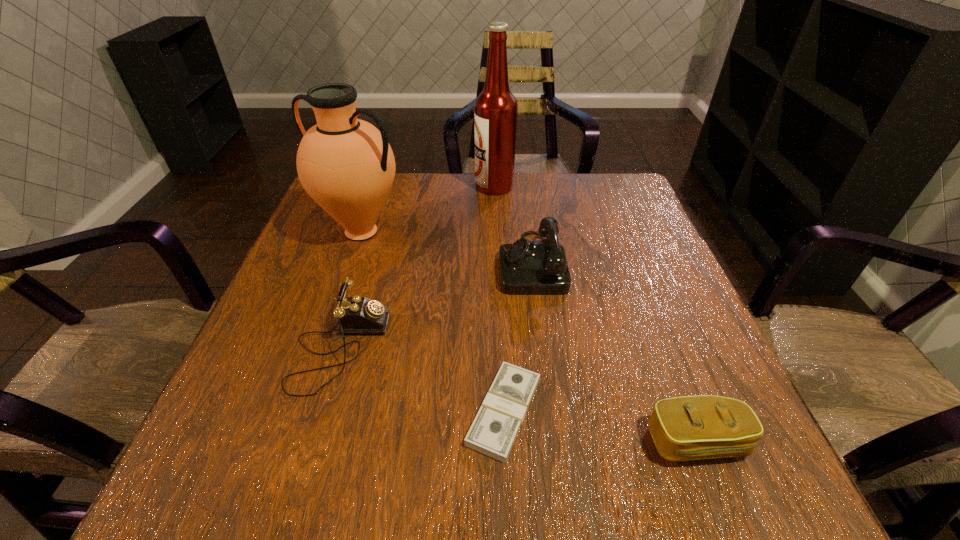
Find the location of a particular element. The height and width of the screenshot is (540, 960). alcohol is located at coordinates (495, 117).

Where is `the farthest object`? This screenshot has width=960, height=540. the farthest object is located at coordinates (495, 117).

Identify the location of the fifth shortest object. (347, 166).

Find the location of a particular element. The height and width of the screenshot is (540, 960). the farther telephone is located at coordinates (526, 267).

The width and height of the screenshot is (960, 540). In order to click on the nearer telephone in this screenshot , I will do `click(357, 315)`.

I want to click on the fourth tallest object, so click(357, 315).

Find the location of a particular element. Image resolution: width=960 pixels, height=540 pixels. the rightmost object is located at coordinates [684, 428].

In order to click on the fifth tallest object in this screenshot , I will do `click(684, 428)`.

Locate an element on the screen. the shortest object is located at coordinates (493, 432).

I want to click on vacant space situated 0.120m on the label side of the tallest object, so click(x=433, y=186).